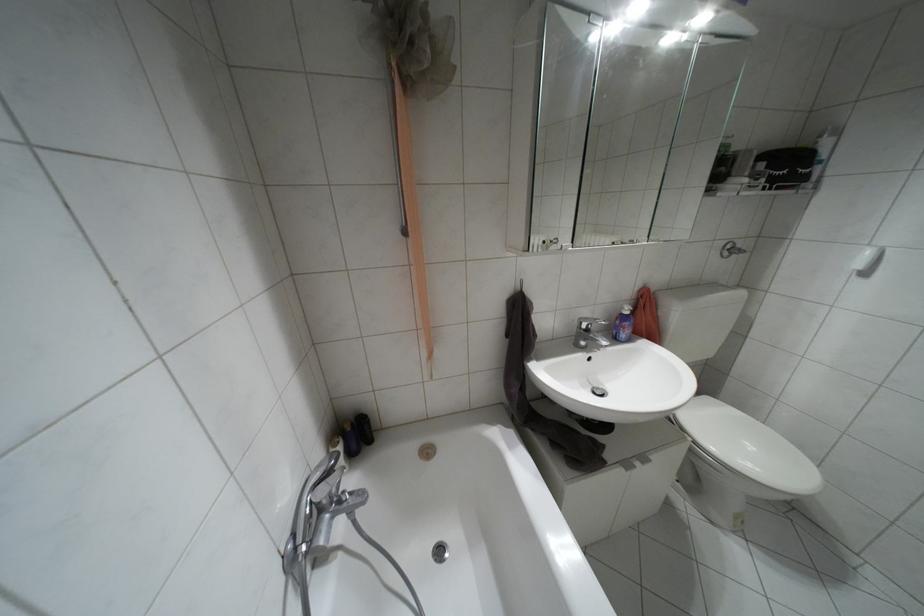
Find where to turn the bathtub faucet handle. Please return your answer as a coordinate pair (x, y).

(326, 485)